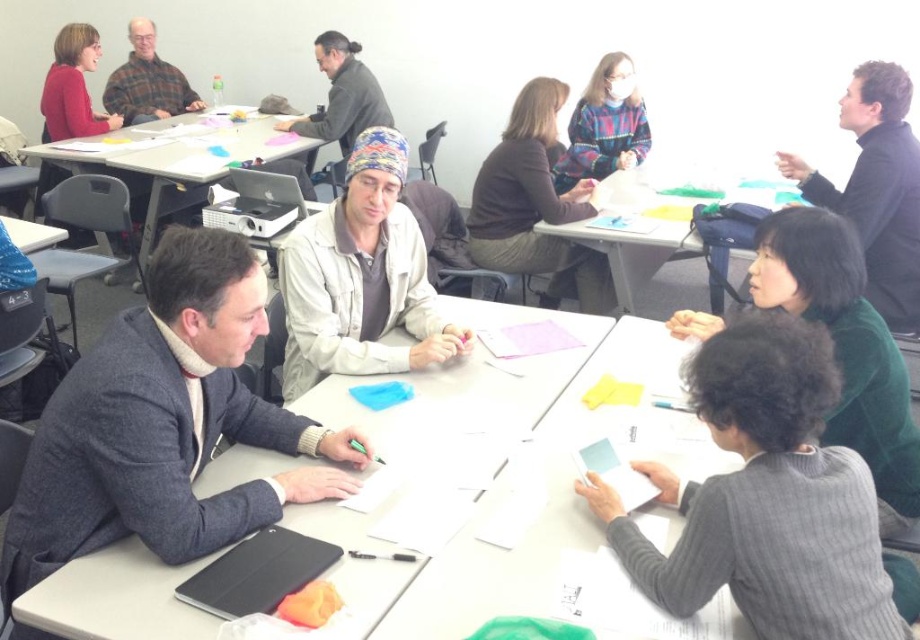
In the collaborative workshop scene, there are several objects and people arranged around tables. You notice a point labeled at coordinates point (844, 344). What object is located at this point?

The point (844, 344) indicates the location of the dark green sweater at lower right.

You are an observer looking at the scene of the collaborative activity. Which object has a smaller height between the white paper at center and the plaid flannel shirt at upper left?

The white paper at center has a lesser height compared to the plaid flannel shirt at upper left.